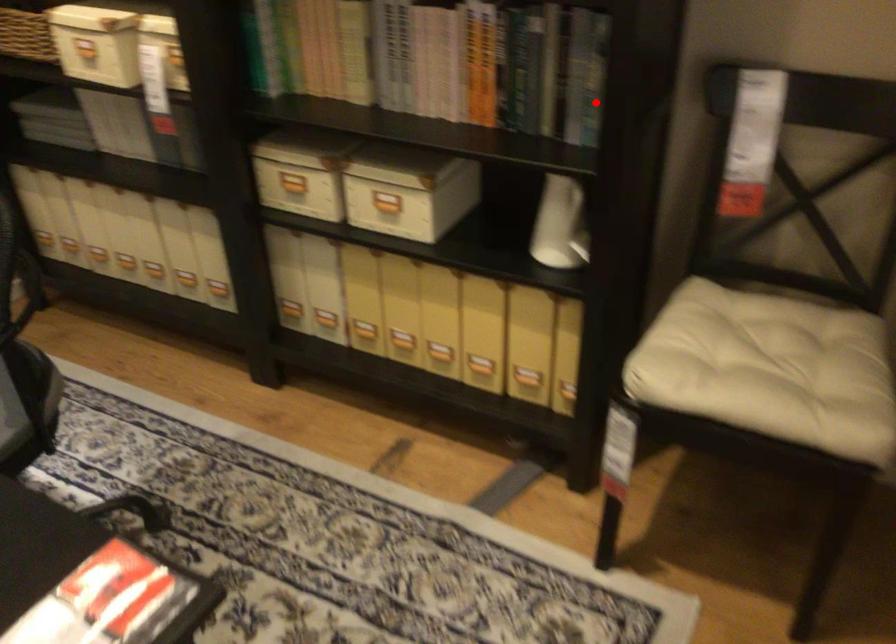
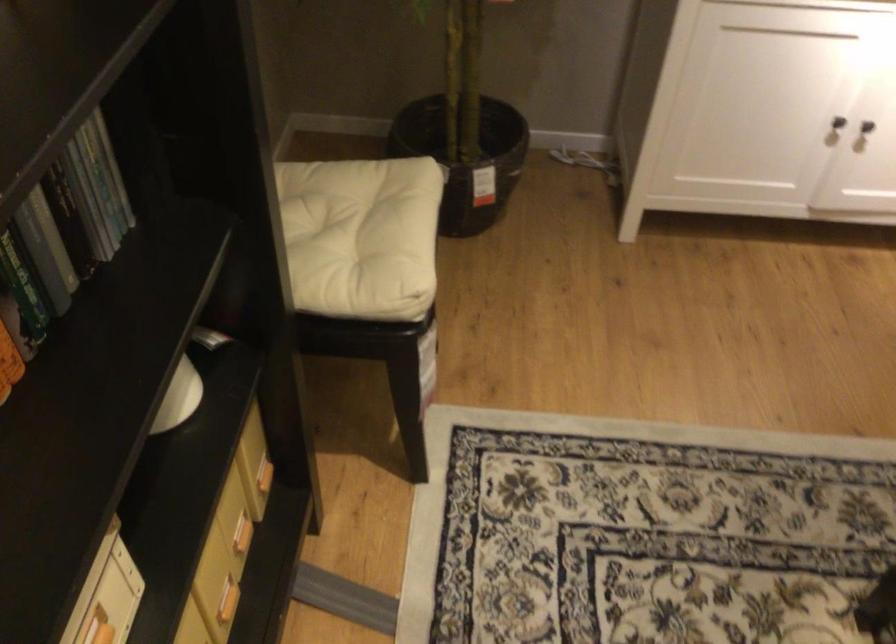
Question: I am providing you with two images of the same scene from different viewpoints. Given a red point in image1, look at the same physical point in image2. Is it:

Choices:
 (A) Closer to the viewpoint
 (B) Farther from the viewpoint

Answer: (A)